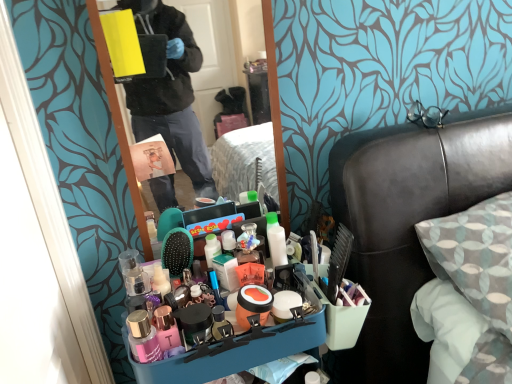
Describe the element at coordinates (407, 224) in the screenshot. I see `black leather headboard at upper right` at that location.

From the picture: What is the approximate width of blue plastic tray at center?

blue plastic tray at center is 15.11 inches in width.

The height and width of the screenshot is (384, 512). Identify the location of yellow matte box at upper left. (122, 42).

At what (x,y) coordinates should I click in order to perform the action: click on black leather headboard at upper right. Please return your answer as a coordinate pair (x, y). Image resolution: width=512 pixels, height=384 pixels. Looking at the image, I should click on (407, 224).

Does point (121, 39) lie behind point (273, 113)?

No, it is in front of (273, 113).

Is yellow matte box at upper left at the left side of clear plastic mirror at center?

Yes, yellow matte box at upper left is to the left of clear plastic mirror at center.

How many degrees apart are the facing directions of yellow matte box at upper left and clear plastic mirror at center?

There is a 5.12-degree angle between the facing directions of yellow matte box at upper left and clear plastic mirror at center.

Looking at this image, considering the relative sizes of yellow matte box at upper left and clear plastic mirror at center in the image provided, is yellow matte box at upper left bigger than clear plastic mirror at center?

No.

From the image's perspective, is blue plastic tray at center positioned above or below black leather headboard at upper right?

Clearly, from the image's perspective, blue plastic tray at center is below black leather headboard at upper right.

From a real-world perspective, between blue plastic tray at center and black leather headboard at upper right, who is vertically higher?

From a 3D spatial view, black leather headboard at upper right is above.

Could you tell me if blue plastic tray at center is turned towards black leather headboard at upper right?

No.

The width and height of the screenshot is (512, 384). In order to click on desk behind the black leather headboard at upper right in this screenshot , I will do `click(234, 353)`.

From a real-world perspective, between blue plastic tray at center and yellow matte box at upper left, who is vertically lower?

In real-world perspective, blue plastic tray at center is lower.

From the image's perspective, who appears lower, blue plastic tray at center or yellow matte box at upper left?

From the image's view, blue plastic tray at center is below.

Is blue plastic tray at center thinner than yellow matte box at upper left?

No.

Is blue plastic tray at center taller than yellow matte box at upper left?

Indeed, blue plastic tray at center has a greater height compared to yellow matte box at upper left.

In terms of height, does matte pink book at center look taller or shorter compared to black leather headboard at upper right?

Clearly, matte pink book at center is shorter compared to black leather headboard at upper right.

The image size is (512, 384). I want to click on furniture located in front of the matte pink book at center, so click(x=407, y=224).

Is matte pink book at center next to black leather headboard at upper right and touching it?

No, matte pink book at center is not with black leather headboard at upper right.

Is matte pink book at center bigger than black leather headboard at upper right?

Actually, matte pink book at center might be smaller than black leather headboard at upper right.

Consider the image. Between black leather headboard at upper right and matte pink book at center, which one has less height?

matte pink book at center is shorter.

Is black leather headboard at upper right positioned before matte pink book at center?

Yes, black leather headboard at upper right is closer to the viewer.

Can you tell me how much black leather headboard at upper right and matte pink book at center differ in facing direction?

The angle between the facing direction of black leather headboard at upper right and the facing direction of matte pink book at center is 2.15 degrees.

Is point (355, 184) closer or farther from the camera than point (142, 159)?

Point (355, 184) is positioned farther from the camera compared to point (142, 159).

Considering the relative sizes of clear plastic mirror at center and matte pink book at center in the image provided, is clear plastic mirror at center wider than matte pink book at center?

Indeed, clear plastic mirror at center has a greater width compared to matte pink book at center.

Is the surface of clear plastic mirror at center in direct contact with matte pink book at center?

clear plastic mirror at center and matte pink book at center are clearly separated.

Looking at the image, does clear plastic mirror at center seem bigger or smaller compared to matte pink book at center?

clear plastic mirror at center is bigger than matte pink book at center.

What's the angular difference between clear plastic mirror at center and matte pink book at center's facing directions?

5.12 degrees.

Is matte pink book at center to the left or to the right of blue plastic tray at center in the image?

From the image, it's evident that matte pink book at center is to the left of blue plastic tray at center.

Is matte pink book at center thinner than blue plastic tray at center?

Yes, matte pink book at center is thinner than blue plastic tray at center.

Which is behind, matte pink book at center or blue plastic tray at center?

matte pink book at center is further from the camera.

The height and width of the screenshot is (384, 512). In the image, there is a matte pink book at center. What are the coordinates of `desk below it (from a real-world perspective)` in the screenshot? It's located at (234, 353).

Find the location of `box behind the clear plastic mirror at center`. box behind the clear plastic mirror at center is located at coordinates (122, 42).

Locate an element on the screen. The height and width of the screenshot is (384, 512). furniture above the blue plastic tray at center (from a real-world perspective) is located at coordinates (407, 224).

Based on their spatial positions, is clear plastic mirror at center or yellow matte box at upper left further from blue plastic tray at center?

The object further to blue plastic tray at center is clear plastic mirror at center.

From the image, which object appears to be farther from matte pink book at center, clear plastic mirror at center or yellow matte box at upper left?

clear plastic mirror at center.

Which object lies further to the anchor point yellow matte box at upper left, blue plastic tray at center or matte pink book at center?

blue plastic tray at center lies further to yellow matte box at upper left than the other object.

In the scene shown: Based on their spatial positions, is yellow matte box at upper left or clear plastic mirror at center further from matte pink book at center?

clear plastic mirror at center is positioned further to the anchor matte pink book at center.

Looking at the image, which one is located closer to yellow matte box at upper left, clear plastic mirror at center or black leather headboard at upper right?

Among the two, black leather headboard at upper right is located nearer to yellow matte box at upper left.

Considering their positions, is matte pink book at center positioned closer to black leather headboard at upper right than blue plastic tray at center?

blue plastic tray at center.

Considering their positions, is black leather headboard at upper right positioned closer to yellow matte box at upper left than matte pink book at center?

matte pink book at center is positioned closer to the anchor yellow matte box at upper left.

Considering their positions, is blue plastic tray at center positioned further to yellow matte box at upper left than clear plastic mirror at center?

clear plastic mirror at center.

Identify the location of book between yellow matte box at upper left and black leather headboard at upper right. The image size is (512, 384). (151, 158).

In order to click on book between clear plastic mirror at center and blue plastic tray at center in the up-down direction in this screenshot , I will do `click(151, 158)`.

The width and height of the screenshot is (512, 384). I want to click on desk between clear plastic mirror at center and black leather headboard at upper right, so click(x=234, y=353).

I want to click on mirror between yellow matte box at upper left and blue plastic tray at center in the vertical direction, so click(x=117, y=116).